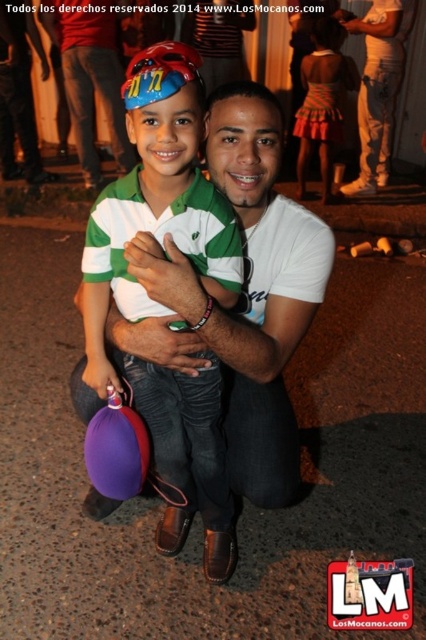
Is white matte shirt at center taller than purple rubber balloon at lower left?

Correct, white matte shirt at center is much taller as purple rubber balloon at lower left.

Who is more forward, [360,131] or [118,422]?

Point [118,422] is more forward.

The width and height of the screenshot is (426, 640). Describe the element at coordinates (377, 92) in the screenshot. I see `white matte shirt at center` at that location.

Where is `white matte shirt at center`? This screenshot has width=426, height=640. white matte shirt at center is located at coordinates (377, 92).

Can you confirm if green matte shirt at center is shorter than purple rubber balloon at lower left?

No, green matte shirt at center is not shorter than purple rubber balloon at lower left.

Is point (176, 404) in front of point (135, 428)?

No.

Who is more distant from viewer, (149, 403) or (109, 432)?

Positioned behind is point (149, 403).

Locate an element on the screen. Image resolution: width=426 pixels, height=640 pixels. green matte shirt at center is located at coordinates (157, 204).

Who is more distant from viewer, (233, 509) or (379, 186)?

The point (379, 186) is behind.

Can you confirm if green matte shirt at center is wider than white matte shirt at center?

No.

Is point (88, 364) more distant than point (351, 32)?

No, (88, 364) is closer to viewer.

Where is `green matte shirt at center`? This screenshot has width=426, height=640. green matte shirt at center is located at coordinates (157, 204).